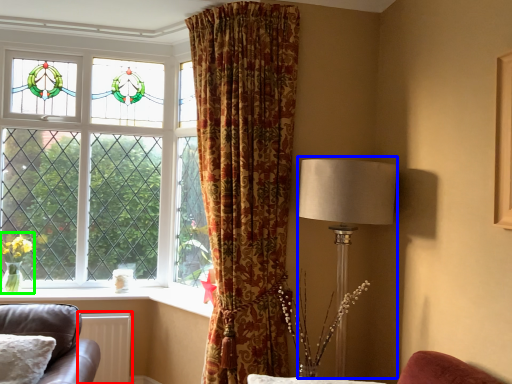
Question: Estimate the real-world distances between objects in this image. Which object is farther from radiator (highlighted by a red box), table lamp (highlighted by a blue box) or floral arrangement (highlighted by a green box)?

Choices:
 (A) table lamp
 (B) floral arrangement

Answer: (A)